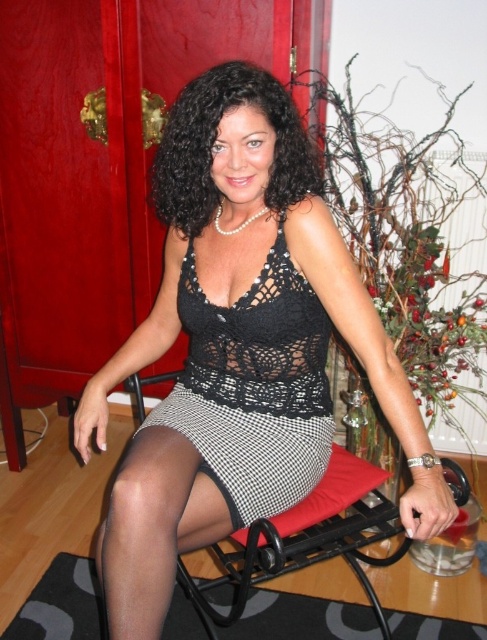
Question: Which point is closer to the camera?

Choices:
 (A) (198, 156)
 (B) (259, 337)
 (C) (268, 474)

Answer: (A)

Question: Which of the following is the farthest from the observer?

Choices:
 (A) black textured mat at lower left
 (B) black houndstooth skirt at center
 (C) black curly hair at center
 (D) black lace dress at center

Answer: (A)

Question: Is black lace top at center bigger than black textured mat at lower left?

Choices:
 (A) no
 (B) yes

Answer: (B)

Question: Which object is farther from the camera taking this photo?

Choices:
 (A) black lace dress at center
 (B) black curly hair at center

Answer: (A)

Question: Where is black curly hair at center located in relation to black houndstooth skirt at center in the image?

Choices:
 (A) below
 (B) above

Answer: (B)

Question: Is black lace top at center closer to the viewer compared to black houndstooth skirt at center?

Choices:
 (A) yes
 (B) no

Answer: (A)